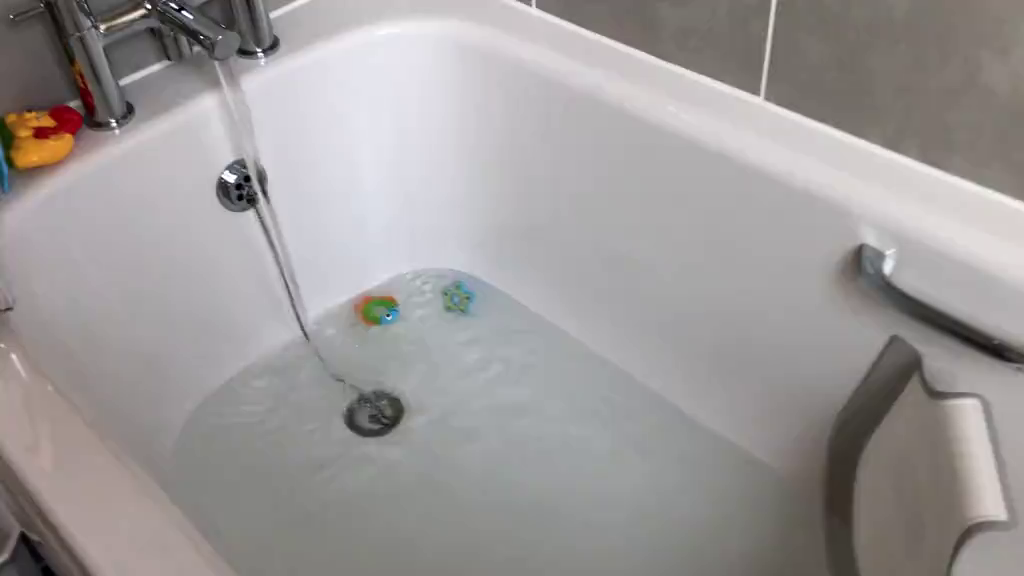
This screenshot has width=1024, height=576. Find the location of `baby bath toys`. baby bath toys is located at coordinates (381, 313), (458, 297), (48, 127).